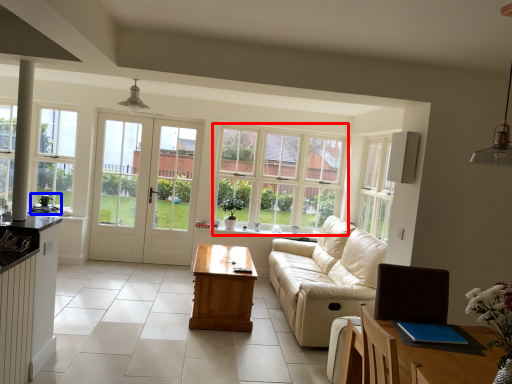
Question: Which object appears farthest to the camera in this image, window (highlighted by a red box) or appliance (highlighted by a blue box)?

Choices:
 (A) window
 (B) appliance

Answer: (A)